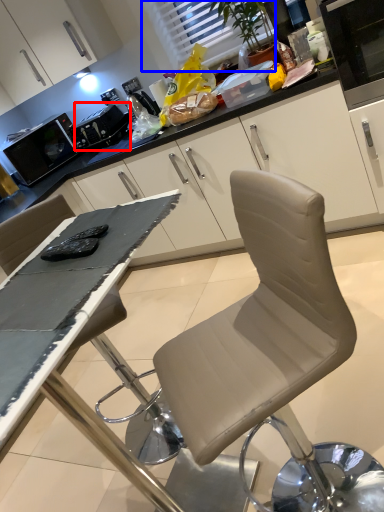
Question: Which object is closer to the camera taking this photo, appliance (highlighted by a red box) or window (highlighted by a blue box)?

Choices:
 (A) appliance
 (B) window

Answer: (B)